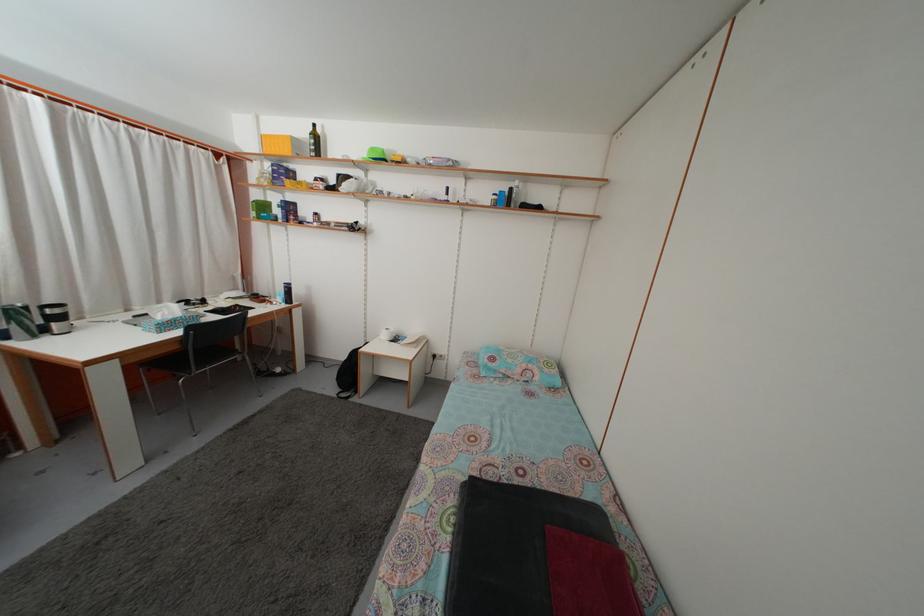
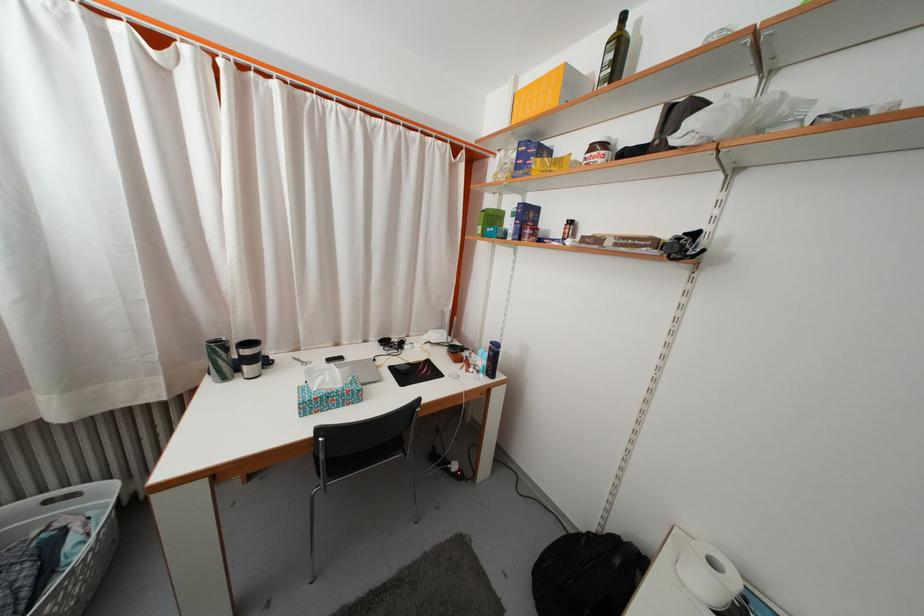
Find the pixel in the second image that matches point (57, 320) in the first image.

(251, 359)